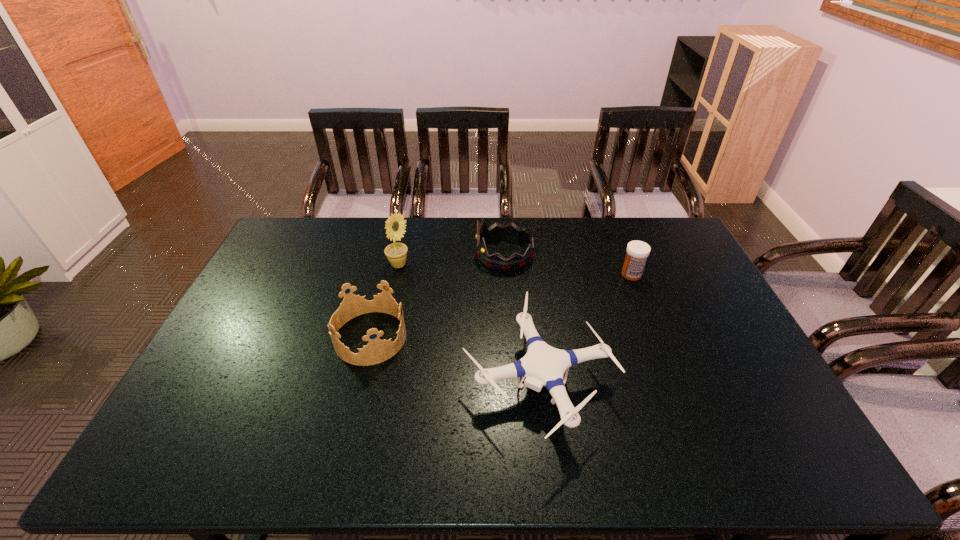
Locate an element on the screen. The height and width of the screenshot is (540, 960). free space that satisfies the following two spatial constraints: 1. on the front-facing side of the drone; 2. on the left side of the nearer tiara is located at coordinates (359, 381).

Where is `vacant point that satisfies the following two spatial constraints: 1. on the face of the drone; 2. on the left side of the tallest object`? vacant point that satisfies the following two spatial constraints: 1. on the face of the drone; 2. on the left side of the tallest object is located at coordinates (373, 381).

Locate an element on the screen. The height and width of the screenshot is (540, 960). free spot that satisfies the following two spatial constraints: 1. on the face of the sunflower; 2. on the back side of the rightmost object is located at coordinates (396, 274).

Identify the location of free space in the image that satisfies the following two spatial constraints: 1. on the front-facing side of the drone; 2. on the right side of the left tiara. (359, 381).

Image resolution: width=960 pixels, height=540 pixels. I want to click on free spot that satisfies the following two spatial constraints: 1. on the front-facing side of the left tiara; 2. on the right side of the drone, so click(x=359, y=381).

Locate an element on the screen. Image resolution: width=960 pixels, height=540 pixels. free spot that satisfies the following two spatial constraints: 1. on the front-facing side of the drone; 2. on the left side of the nearer tiara is located at coordinates (359, 381).

You are a GUI agent. You are given a task and a screenshot of the screen. Output one action in this format:
    pyautogui.click(x=<x>, y=<y>)
    Task: Click on the free point that satisfies the following two spatial constraints: 1. on the back side of the rightmost object; 2. at the front of the right tiara with jewels
    The width and height of the screenshot is (960, 540).
    Given the screenshot: What is the action you would take?
    pyautogui.click(x=623, y=254)